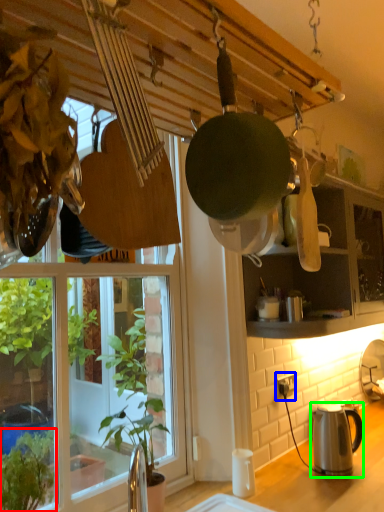
Question: Which object is positioned farthest from houseplant (highlighted by a red box)? Select from power outlet (highlighted by a blue box) and kettle (highlighted by a green box).

Choices:
 (A) power outlet
 (B) kettle

Answer: (A)